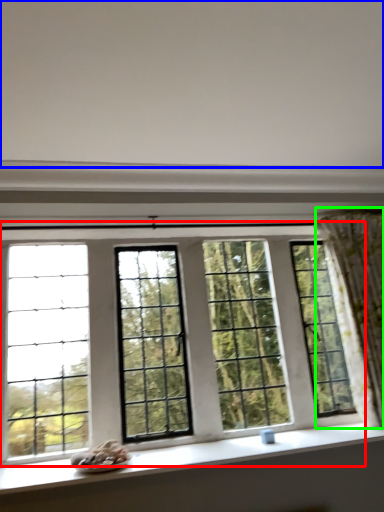
Question: Which object is positioned farthest from window (highlighted by a red box)? Select from backdrop (highlighted by a blue box) and curtain (highlighted by a green box).

Choices:
 (A) backdrop
 (B) curtain

Answer: (A)